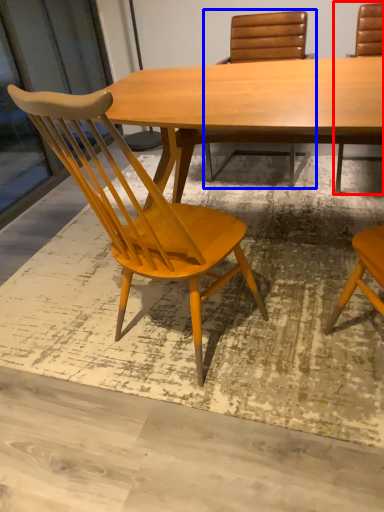
Question: Among these objects, which one is nearest to the camera, chair (highlighted by a red box) or chair (highlighted by a blue box)?

Choices:
 (A) chair
 (B) chair

Answer: (A)